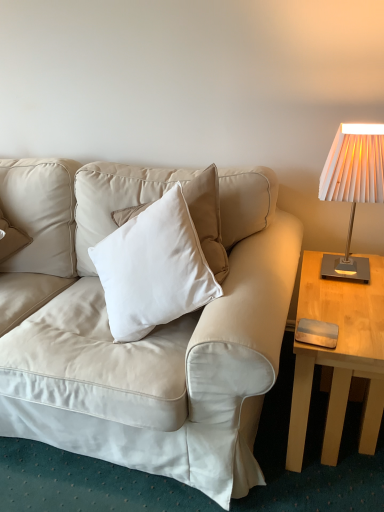
Question: Does light wood table at right have a larger size compared to beige leather couch at center?

Choices:
 (A) yes
 (B) no

Answer: (B)

Question: Is light wood table at right turned away from beige leather couch at center?

Choices:
 (A) yes
 (B) no

Answer: (B)

Question: Is light wood table at right aimed at beige leather couch at center?

Choices:
 (A) yes
 (B) no

Answer: (B)

Question: Can you confirm if light wood table at right is wider than beige leather couch at center?

Choices:
 (A) yes
 (B) no

Answer: (A)

Question: Can you confirm if light wood table at right is shorter than beige leather couch at center?

Choices:
 (A) yes
 (B) no

Answer: (A)

Question: Are light wood table at right and beige leather couch at center located far from each other?

Choices:
 (A) yes
 (B) no

Answer: (B)

Question: Is beige leather pillow at upper left aimed at light wood table at right?

Choices:
 (A) yes
 (B) no

Answer: (B)

Question: Would you say beige leather pillow at upper left is a long distance from light wood table at right?

Choices:
 (A) no
 (B) yes

Answer: (B)

Question: Can you confirm if beige leather pillow at upper left is taller than light wood table at right?

Choices:
 (A) yes
 (B) no

Answer: (A)

Question: Can you confirm if beige leather pillow at upper left is bigger than light wood table at right?

Choices:
 (A) yes
 (B) no

Answer: (B)

Question: Does beige leather pillow at upper left have a greater width compared to light wood table at right?

Choices:
 (A) yes
 (B) no

Answer: (B)

Question: Is beige leather pillow at upper left turned away from light wood table at right?

Choices:
 (A) no
 (B) yes

Answer: (A)

Question: Considering the relative sizes of light wood table at right and metallic silver pad at right in the image provided, is light wood table at right shorter than metallic silver pad at right?

Choices:
 (A) no
 (B) yes

Answer: (A)